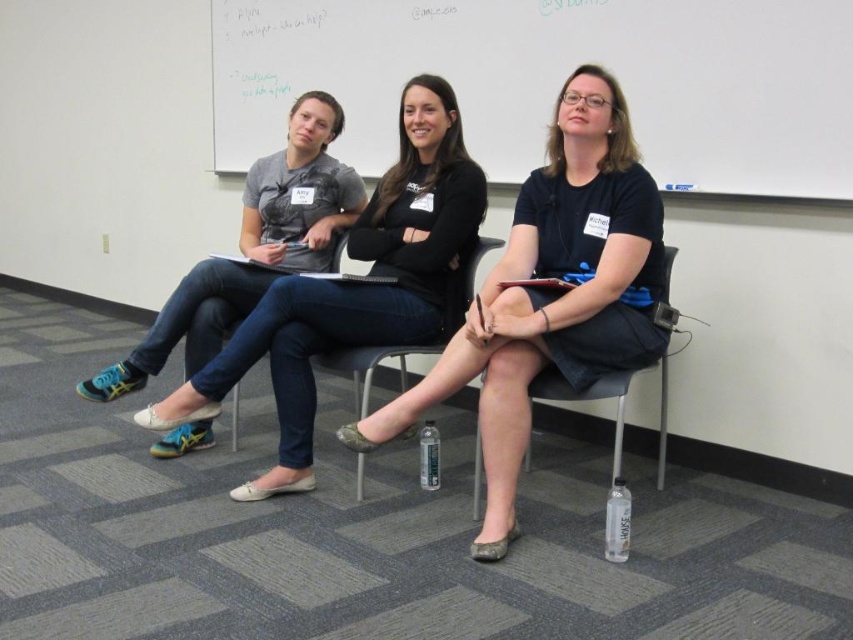
You are standing at the point marked as point (419, 406) in the classroom. You need to walk to the whiteboard which is 10 feet away from you. If you walk straight ahead, will you reach the whiteboard before reaching the nearest person?

The nearest person is 7.06 feet away from point (419, 406). Since the whiteboard is 10 feet away, you will reach the nearest person first before reaching the whiteboard.